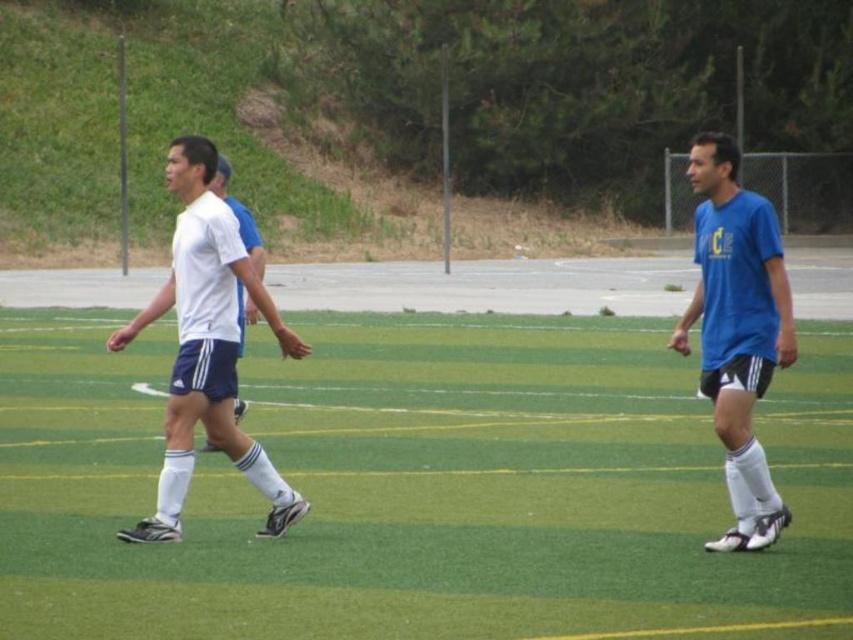
From the picture: You are a soccer player standing on the field and want to kick the ball towards the white matte shorts at center. Since the green artificial turf at center is in the way, can you still kick the ball past it?

The green artificial turf at center is closer to the viewer than white matte shorts at center, so you can kick the ball past the green artificial turf at center to reach the white matte shorts at center.

You are a soccer player standing on the field and want to move from the point at coordinates point (x=544, y=461) to the point at coordinates point (x=743, y=308). Which direction should you move in relation to the field?

You should move towards the right and upwards because point (x=743, y=308) is located to the left and below point (x=544, y=461).

You are a soccer player trying to decide where to place your new equipment bag. You see the green artificial turf at center and the blue matte shirt at center. Which surface is bigger and can hold the bag more securely?

The green artificial turf at center is larger in size than the blue matte shirt at center, so it can hold the bag more securely.